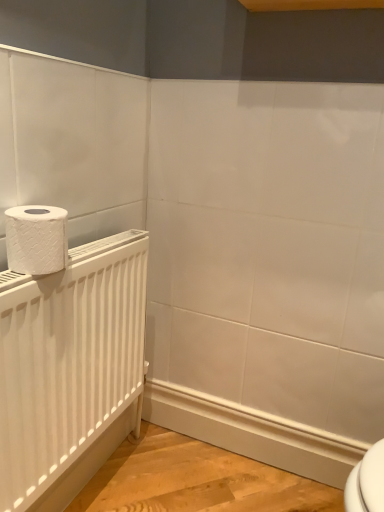
Describe the element at coordinates (36, 239) in the screenshot. I see `white textured toilet paper at left` at that location.

Image resolution: width=384 pixels, height=512 pixels. What are the coordinates of `white textured toilet paper at left` in the screenshot? It's located at (36, 239).

What is the approximate height of white textured toilet paper at left?

It is 11.07 centimeters.

What do you see at coordinates (68, 360) in the screenshot?
I see `white matte radiator at left` at bounding box center [68, 360].

This screenshot has width=384, height=512. What are the coordinates of `white matte radiator at left` in the screenshot? It's located at (68, 360).

I want to click on white textured toilet paper at left, so click(36, 239).

In the image, is white matte radiator at left on the left side or the right side of white textured toilet paper at left?

In the image, white matte radiator at left appears on the right side of white textured toilet paper at left.

Between white matte radiator at left and white textured toilet paper at left, which one is positioned behind?

white textured toilet paper at left is behind.

Does point (3, 480) come closer to viewer compared to point (26, 209)?

Yes, point (3, 480) is closer to viewer.

From the image's perspective, is white matte radiator at left positioned above or below white textured toilet paper at left?

Based on their image positions, white matte radiator at left is located beneath white textured toilet paper at left.

From a real-world perspective, is white matte radiator at left above or below white textured toilet paper at left?

In terms of real-world spatial position, white matte radiator at left is below white textured toilet paper at left.

Looking at their sizes, would you say white matte radiator at left is wider or thinner than white textured toilet paper at left?

Clearly, white matte radiator at left has less width compared to white textured toilet paper at left.

From their relative heights in the image, would you say white matte radiator at left is taller or shorter than white textured toilet paper at left?

In the image, white matte radiator at left appears to be taller than white textured toilet paper at left.

Who is smaller, white matte radiator at left or white textured toilet paper at left?

Smaller between the two is white textured toilet paper at left.

Choose the correct answer: Is white matte radiator at left inside white textured toilet paper at left or outside it?

white matte radiator at left is spatially situated outside white textured toilet paper at left.

Are white matte radiator at left and white textured toilet paper at left making contact?

No.

Is white textured toilet paper at left at the back of white matte radiator at left?

white matte radiator at left does not have its back to white textured toilet paper at left.

I want to click on radiator below the white textured toilet paper at left (from a real-world perspective), so pos(68,360).

Would you say white textured toilet paper at left is to the left or to the right of white matte radiator at left in the picture?

Clearly, white textured toilet paper at left is on the left of white matte radiator at left in the image.

From the picture: Which object is closer to the camera, white textured toilet paper at left or white matte radiator at left?

white matte radiator at left is closer to the camera.

Is point (7, 256) positioned behind point (124, 274)?

No, it is in front of (124, 274).

From the image's perspective, is white textured toilet paper at left above white matte radiator at left?

Yes, from the image's perspective, white textured toilet paper at left is over white matte radiator at left.

From a real-world perspective, is white textured toilet paper at left located beneath white matte radiator at left?

No.

Is white textured toilet paper at left wider or thinner than white matte radiator at left?

white textured toilet paper at left is wider than white matte radiator at left.

From the picture: Between white textured toilet paper at left and white matte radiator at left, which one has less height?

Standing shorter between the two is white textured toilet paper at left.

Considering the relative sizes of white textured toilet paper at left and white matte radiator at left in the image provided, is white textured toilet paper at left smaller than white matte radiator at left?

Correct, white textured toilet paper at left occupies less space than white matte radiator at left.

Would you say white textured toilet paper at left is inside or outside white matte radiator at left?

white textured toilet paper at left is outside white matte radiator at left.

Is white textured toilet paper at left directly adjacent to white matte radiator at left?

No.

Is white textured toilet paper at left oriented towards white matte radiator at left?

No, white textured toilet paper at left is not oriented towards white matte radiator at left.

Can you tell me how much white textured toilet paper at left and white matte radiator at left differ in facing direction?

The facing directions of white textured toilet paper at left and white matte radiator at left are 0.00107 degrees apart.

Where is `radiator that is on the right side of white textured toilet paper at left`? The image size is (384, 512). radiator that is on the right side of white textured toilet paper at left is located at coordinates (68, 360).

Find the location of a particular element. The width and height of the screenshot is (384, 512). radiator that appears on the right of white textured toilet paper at left is located at coordinates (68, 360).

Identify the location of radiator in front of the white textured toilet paper at left. The height and width of the screenshot is (512, 384). (68, 360).